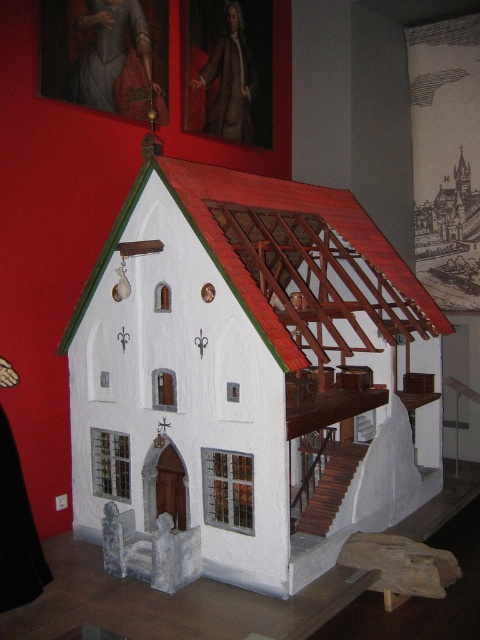
Which is behind, point (228, 433) or point (95, 99)?

Positioned behind is point (95, 99).

Can you confirm if white painted wood chapel at center is positioned to the left of matte red cloth at upper left?

In fact, white painted wood chapel at center is to the right of matte red cloth at upper left.

Does point (98, 353) come in front of point (82, 13)?

That is True.

I want to click on white painted wood chapel at center, so click(240, 376).

Between white painted wood chapel at center and brown leather coat at upper center, which one appears on the left side from the viewer's perspective?

brown leather coat at upper center is more to the left.

From the picture: Is white painted wood chapel at center thinner than brown leather coat at upper center?

In fact, white painted wood chapel at center might be wider than brown leather coat at upper center.

Find the location of a particular element. white painted wood chapel at center is located at coordinates click(240, 376).

Where is `white painted wood chapel at center`? This screenshot has height=640, width=480. white painted wood chapel at center is located at coordinates (240, 376).

Which of these two, matte red cloth at upper left or brown leather coat at upper center, stands taller?

brown leather coat at upper center

Does matte red cloth at upper left appear on the right side of brown leather coat at upper center?

No, matte red cloth at upper left is not to the right of brown leather coat at upper center.

In order to click on matte red cloth at upper left in this screenshot , I will do `click(112, 58)`.